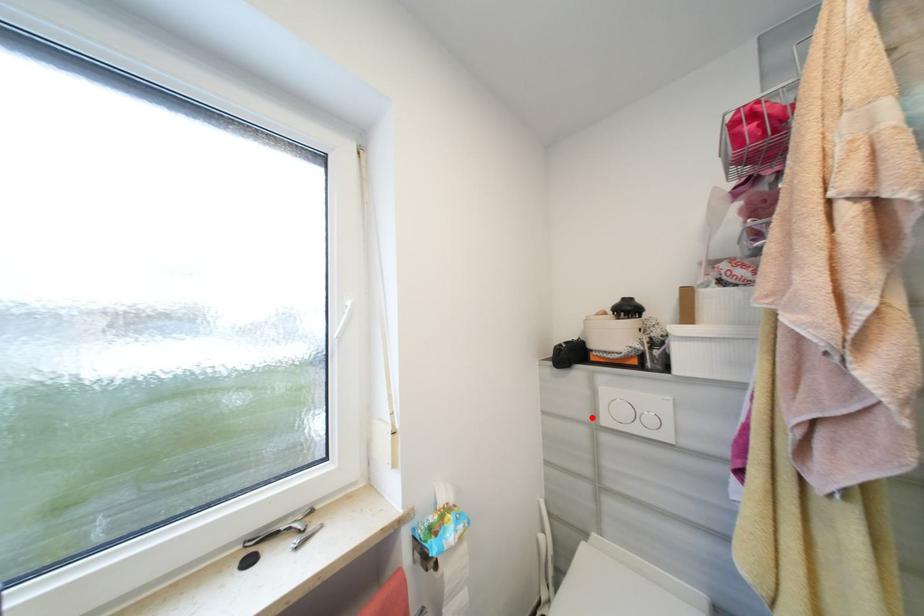
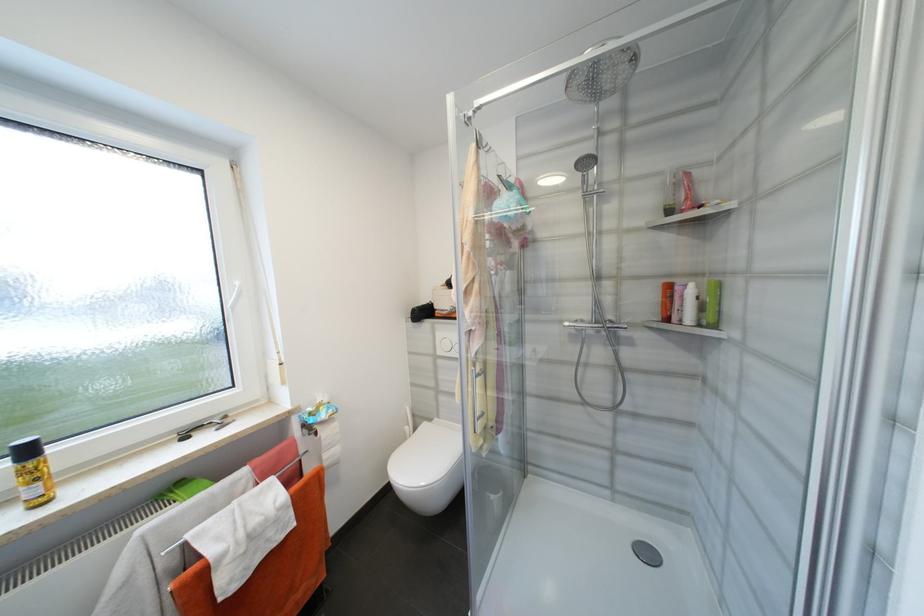
Question: I am providing you with two images of the same scene from different viewpoints. In image1, a red point is highlighted. Considering the same 3D point in image2, which of the following is correct?

Choices:
 (A) It is closer
 (B) It is farther

Answer: (B)